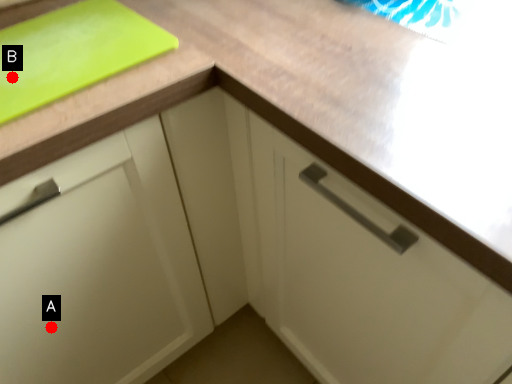
Question: Two points are circled on the image, labeled by A and B beside each circle. Which point is closer to the camera?

Choices:
 (A) A is closer
 (B) B is closer

Answer: (B)